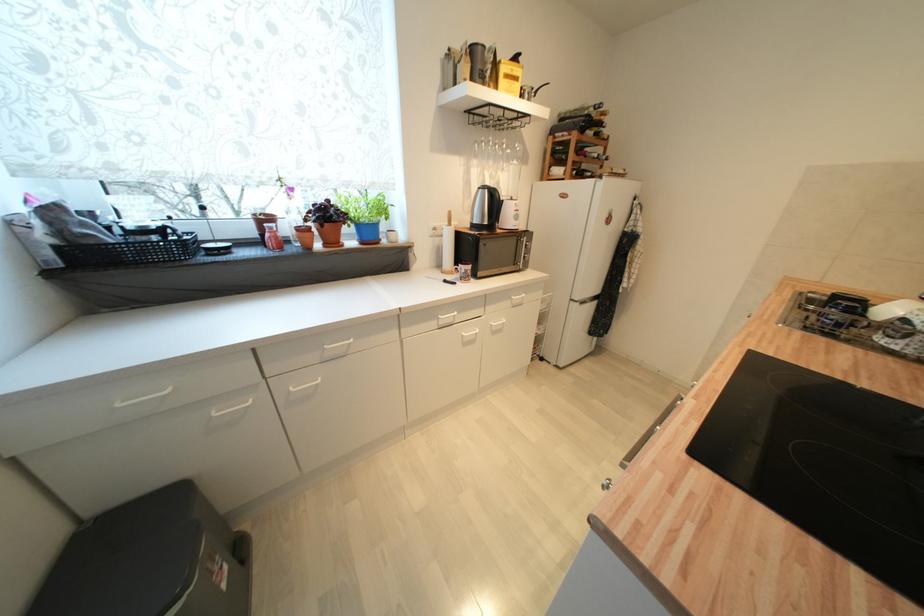
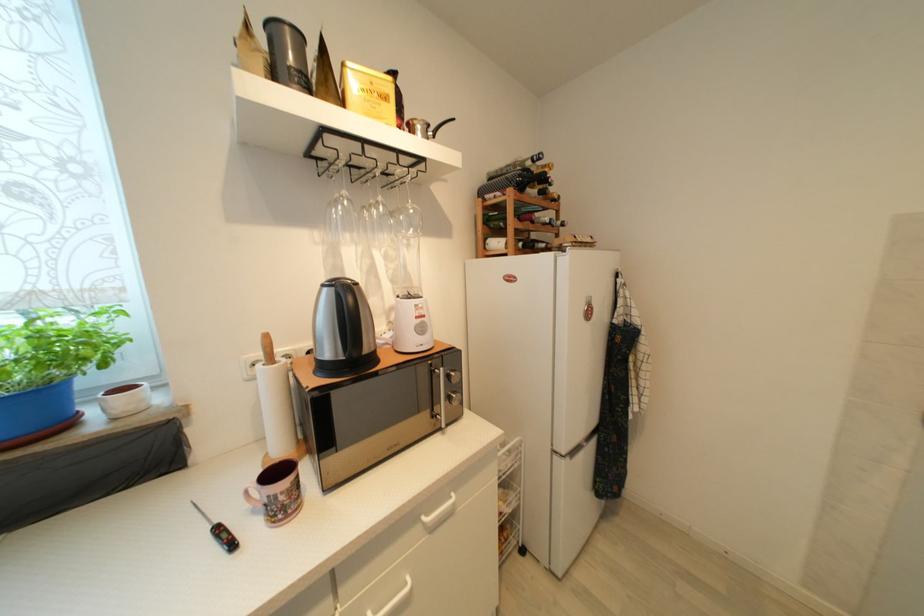
In the second image, find the point that corresponds to (586,111) in the first image.

(518, 166)